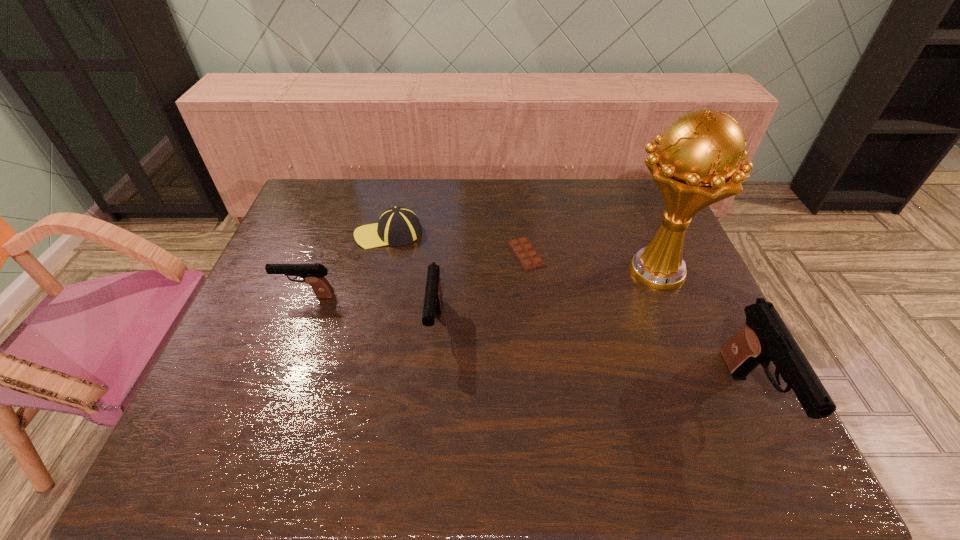
The height and width of the screenshot is (540, 960). What are the coordinates of `vacant region located with the brim of the fifth object from right to left facing forward` in the screenshot? It's located at (340, 234).

This screenshot has width=960, height=540. I want to click on free space located on the front of the third object from right to left, so click(539, 365).

At what (x,y) coordinates should I click in order to perform the action: click on object that is positioned at the far edge. Please return your answer as a coordinate pair (x, y). The width and height of the screenshot is (960, 540). Looking at the image, I should click on (397, 226).

Identify the location of object that is at the near edge. (765, 337).

Find the location of a particular element. Image resolution: width=960 pixels, height=540 pixels. object located in the left edge section of the desktop is located at coordinates (313, 274).

Locate an element on the screen. Image resolution: width=960 pixels, height=540 pixels. pistol that is at the right edge is located at coordinates (765, 337).

This screenshot has height=540, width=960. I want to click on trophy_cup located at the right edge, so click(x=696, y=164).

The image size is (960, 540). What are the coordinates of `object that is at the near right corner` in the screenshot? It's located at (765, 337).

Locate an element on the screen. The image size is (960, 540). blank space at the far edge of the desktop is located at coordinates (456, 193).

Where is `vacant region at the near edge`? This screenshot has width=960, height=540. vacant region at the near edge is located at coordinates (359, 393).